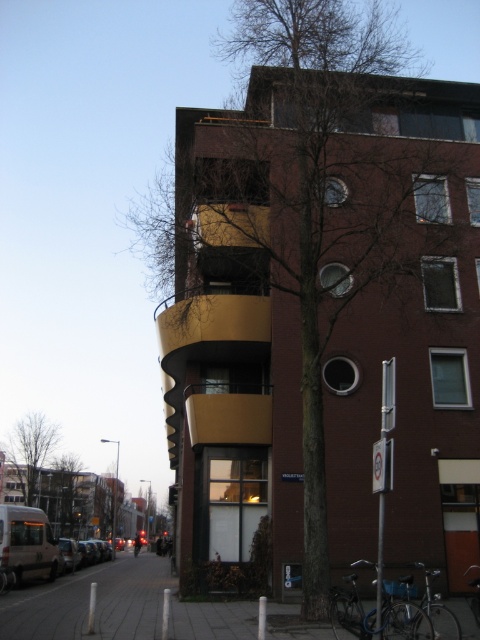
Is bare branches at left wider than green leafy tree at center?

Yes.

This screenshot has width=480, height=640. Describe the element at coordinates (28, 454) in the screenshot. I see `bare branches at left` at that location.

Does point (7, 500) come behind point (54, 464)?

That is False.

Identify the location of bare branches at left. (28, 454).

Does brown textured tree at center lie in front of green leafy tree at center?

Yes, it is in front of green leafy tree at center.

Is brown textured tree at center taller than green leafy tree at center?

Indeed, brown textured tree at center has a greater height compared to green leafy tree at center.

Describe the element at coordinates (322, 300) in the screenshot. This screenshot has width=480, height=640. I see `brown textured tree at center` at that location.

The image size is (480, 640). Find the location of `brown textured tree at center`. brown textured tree at center is located at coordinates (322, 300).

Which is behind, point (428, 465) or point (12, 461)?

The point (12, 461) is behind.

Between brown textured tree at center and bare branches at left, which one is positioned lower?

bare branches at left

Between point (175, 141) and point (37, 464), which one is positioned behind?

The point (37, 464) is behind.

Where is `brown textured tree at center`? brown textured tree at center is located at coordinates (322, 300).